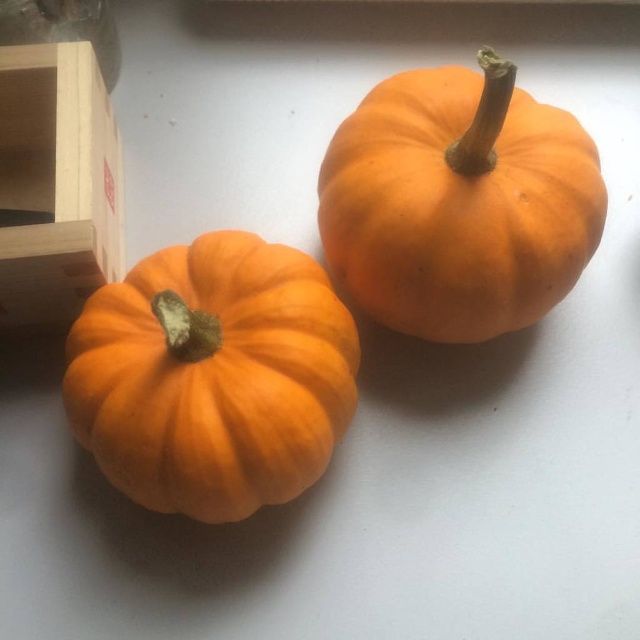
Question: Does orange matte pumpkin at lower left appear over orange matte pumpkin at upper right?

Choices:
 (A) no
 (B) yes

Answer: (A)

Question: Among these objects, which one is nearest to the camera?

Choices:
 (A) orange matte pumpkin at lower left
 (B) orange matte pumpkin at upper right

Answer: (A)

Question: Is orange matte pumpkin at lower left to the left of orange matte pumpkin at upper right from the viewer's perspective?

Choices:
 (A) yes
 (B) no

Answer: (A)

Question: Which point is farther from the camera taking this photo?

Choices:
 (A) (422, 72)
 (B) (198, 468)

Answer: (A)

Question: Is orange matte pumpkin at lower left to the right of orange matte pumpkin at upper right from the viewer's perspective?

Choices:
 (A) yes
 (B) no

Answer: (B)

Question: Which object appears closest to the camera in this image?

Choices:
 (A) orange matte pumpkin at lower left
 (B) orange matte pumpkin at upper right

Answer: (A)